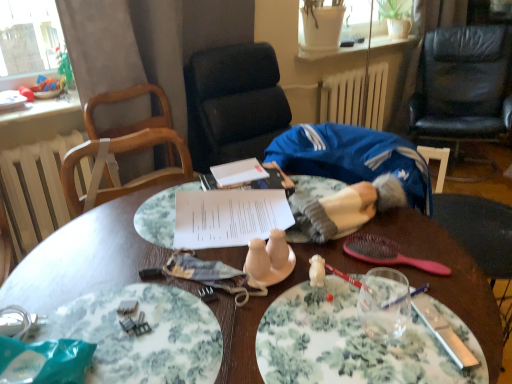
Question: Visually, is black leather chair at upper right positioned to the left or to the right of white paper at center?

Choices:
 (A) right
 (B) left

Answer: (A)

Question: In terms of width, does black leather chair at upper right look wider or thinner when compared to white paper at center?

Choices:
 (A) wide
 (B) thin

Answer: (A)

Question: Which is farther from the floral ceramic plate at center, marked as the first plate in a right-to-left arrangement?

Choices:
 (A) black leather chair at upper right
 (B) silver metallic knife at lower right
 (C) white matte radiator at upper center, the 2th radiator positioned from the front
 (D) floral-patterned plate at lower left, which is counted as the 2th plate, starting from the right
 (E) white ceramic salt and pepper shakers at center

Answer: (A)

Question: Which object is the closest to the pink plastic spoon at lower right?

Choices:
 (A) wooden table at center
 (B) floral-patterned plate at lower left, which is counted as the 2th plate, starting from the right
 (C) white radiator at left, the first radiator viewed from the left
 (D) black leather chair at upper right
 (E) white ceramic salt and pepper shakers at center

Answer: (E)